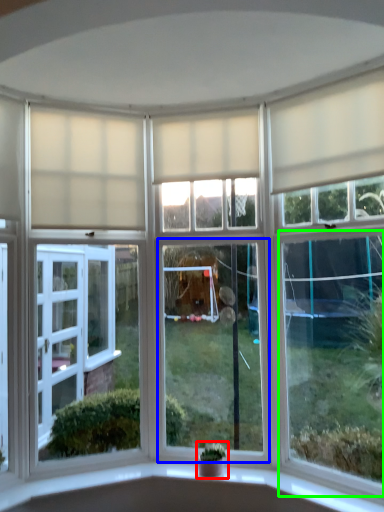
Question: Based on their relative distances, which object is nearer to houseplant (highlighted by a red box)? Choose from window (highlighted by a blue box) and window (highlighted by a green box).

Choices:
 (A) window
 (B) window

Answer: (A)